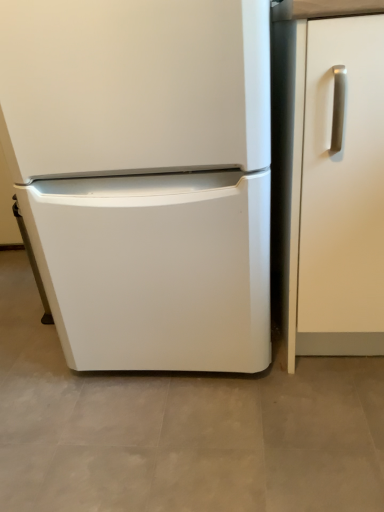
Question: In terms of size, does white matte refrigerator at center appear bigger or smaller than white matte cabinet handle at right?

Choices:
 (A) small
 (B) big

Answer: (B)

Question: Considering the positions of white matte refrigerator at center and white matte cabinet handle at right in the image, is white matte refrigerator at center wider or thinner than white matte cabinet handle at right?

Choices:
 (A) wide
 (B) thin

Answer: (A)

Question: From the image's perspective, is white matte refrigerator at center above or below white matte cabinet handle at right?

Choices:
 (A) above
 (B) below

Answer: (A)

Question: Would you say white matte cabinet handle at right is inside or outside white matte refrigerator at center?

Choices:
 (A) inside
 (B) outside

Answer: (B)

Question: Considering the positions of white matte cabinet handle at right and white matte refrigerator at center in the image, is white matte cabinet handle at right taller or shorter than white matte refrigerator at center?

Choices:
 (A) tall
 (B) short

Answer: (B)

Question: From a real-world perspective, relative to white matte refrigerator at center, is white matte cabinet handle at right vertically above or below?

Choices:
 (A) above
 (B) below

Answer: (B)

Question: In terms of width, does white matte cabinet handle at right look wider or thinner when compared to white matte refrigerator at center?

Choices:
 (A) thin
 (B) wide

Answer: (A)